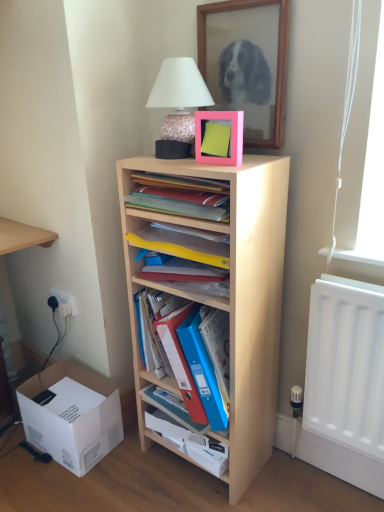
I want to click on blank space situated above light wood shelf at center, the second shelf in the bottom-to-top sequence (from a real-world perspective), so click(216, 158).